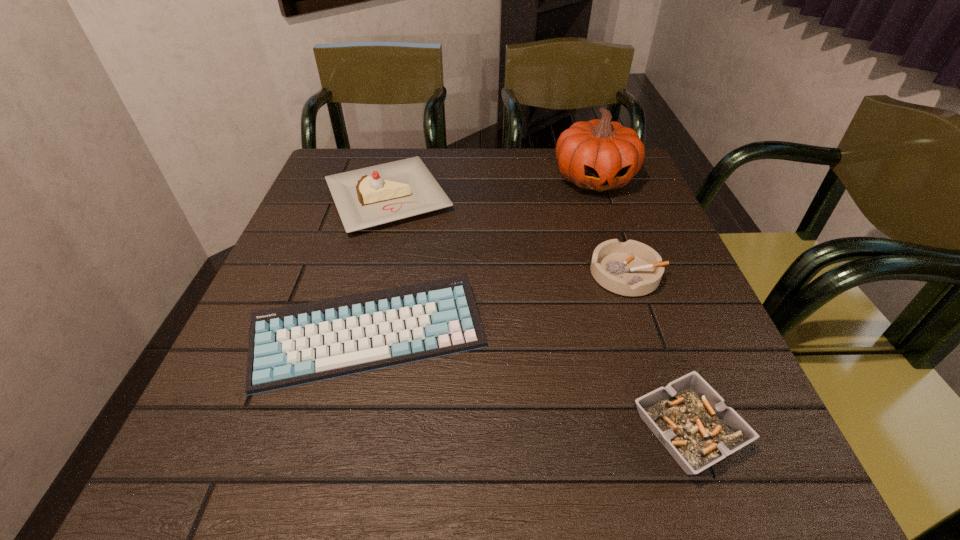
Locate an element on the screen. empty space between the second tallest object and the computer keyboard is located at coordinates (378, 266).

Find the location of a particular element. Image resolution: width=960 pixels, height=540 pixels. empty space between the computer keyboard and the cake is located at coordinates (378, 266).

The image size is (960, 540). What are the coordinates of `vacant area between the computer keyboard and the tallest object` in the screenshot? It's located at (482, 257).

Image resolution: width=960 pixels, height=540 pixels. I want to click on empty space between the nearer ashtray and the pumpkin, so click(x=640, y=305).

This screenshot has width=960, height=540. What are the coordinates of `the closest object relative to the cake` in the screenshot? It's located at click(297, 344).

Identify which object is the closest to the nearer ashtray. Please provide its 2D coordinates. Your answer should be formatted as a tuple, i.e. [(x, y)], where the tuple contains the x and y coordinates of a point satisfying the conditions above.

[(631, 268)]

Locate an element on the screen. The height and width of the screenshot is (540, 960). free space in the image that satisfies the following two spatial constraints: 1. on the back side of the farther ashtray; 2. on the left side of the computer keyboard is located at coordinates (384, 274).

Where is `free point that satisfies the following two spatial constraints: 1. on the face of the nearer ashtray; 2. on the left side of the pumpkin`? free point that satisfies the following two spatial constraints: 1. on the face of the nearer ashtray; 2. on the left side of the pumpkin is located at coordinates (681, 430).

Where is `vacant space that satisfies the following two spatial constraints: 1. on the face of the pumpkin; 2. on the left side of the nearer ashtray`? vacant space that satisfies the following two spatial constraints: 1. on the face of the pumpkin; 2. on the left side of the nearer ashtray is located at coordinates (681, 430).

Find the location of a particular element. The image size is (960, 540). free space that satisfies the following two spatial constraints: 1. on the front side of the computer keyboard; 2. on the left side of the fourth shortest object is located at coordinates (350, 335).